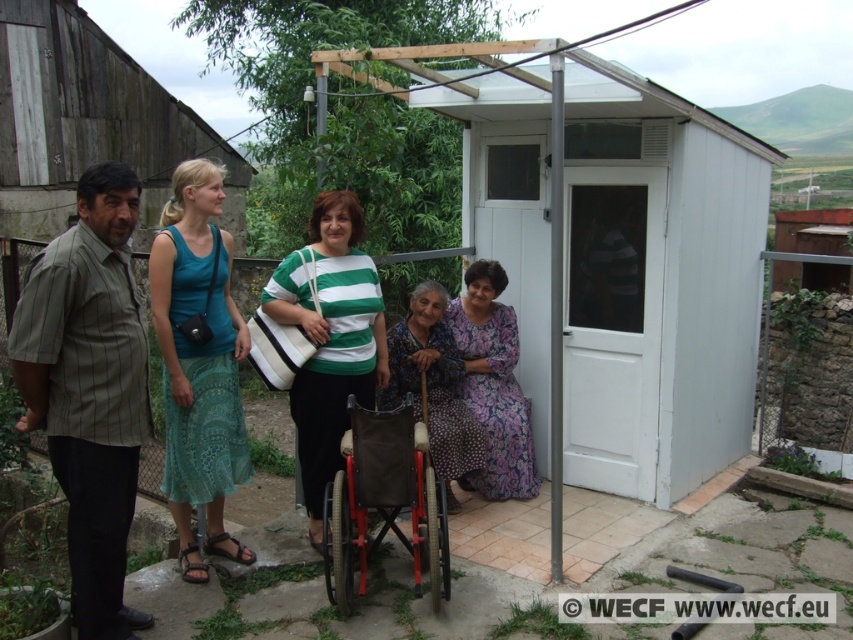
You are planning to place a large sculpture that requires a base area of 3 square meters. The white plastic hut at center and the printed fabric dress at center are in the way. Which object should you move to accommodate the sculpture?

The white plastic hut at center is larger in size than the printed fabric dress at center, so you should move the white plastic hut at center to accommodate the sculpture since it occupies more space and might be easier to relocate for the required base area.